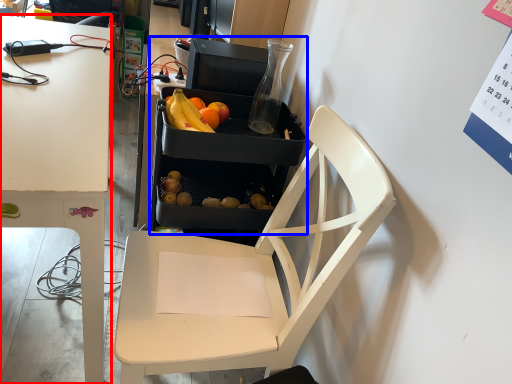
Question: Which object appears farthest to the camera in this image, desk (highlighted by a red box) or appliance (highlighted by a blue box)?

Choices:
 (A) desk
 (B) appliance

Answer: (B)